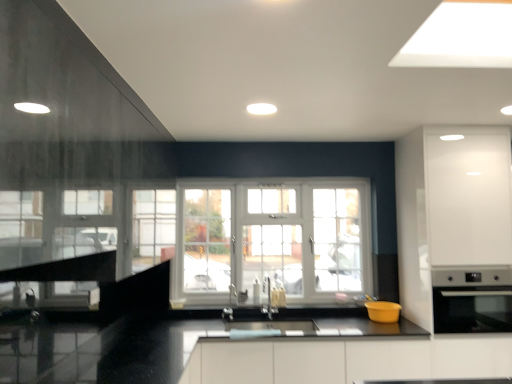
Question: From a real-world perspective, is white plastic window at center positioned above or below satin nickel faucet at center, placed as the 1th faucet when sorted from left to right?

Choices:
 (A) above
 (B) below

Answer: (A)

Question: Considering the positions of point (106, 233) and point (228, 316), is point (106, 233) closer or farther from the camera than point (228, 316)?

Choices:
 (A) closer
 (B) farther

Answer: (A)

Question: Which object is positioned farthest from the black glossy countertop at center?

Choices:
 (A) white plastic window at center
 (B) yellow matte bowl at lower center, the first appliance when ordered from left to right
 (C) satin nickel faucet at center, placed as the 1th faucet when sorted from left to right
 (D) satin silver oven at right, positioned as the 1th appliance in right-to-left order
 (E) satin nickel faucet at center, which is the second faucet from left to right

Answer: (C)

Question: Considering the real-world distances, which object is closest to the satin nickel faucet at center, which appears as the second faucet when viewed from the right?

Choices:
 (A) satin nickel faucet at center, which is the first faucet in right-to-left order
 (B) white plastic window at center
 (C) black glossy countertop at center
 (D) yellow matte bowl at lower center, the first appliance when ordered from left to right
 (E) satin silver oven at right, positioned as the 1th appliance in right-to-left order

Answer: (A)